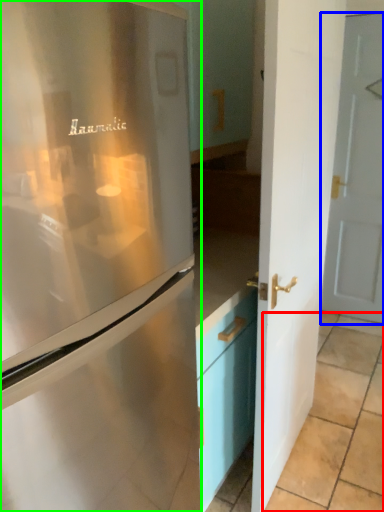
Question: Based on their relative distances, which object is farther from tile (highlighted by a red box)? Choose from door (highlighted by a blue box) and refrigerator (highlighted by a green box).

Choices:
 (A) door
 (B) refrigerator

Answer: (B)